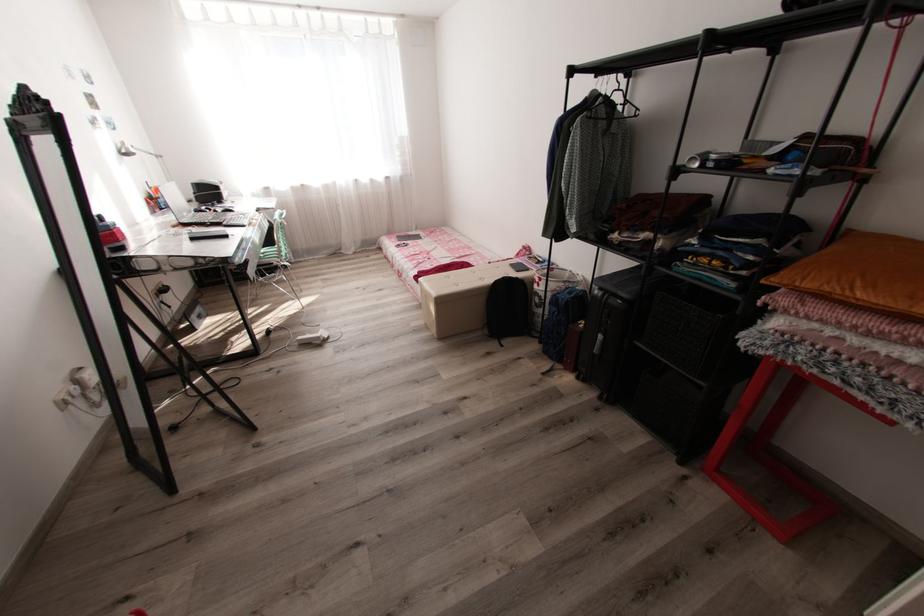
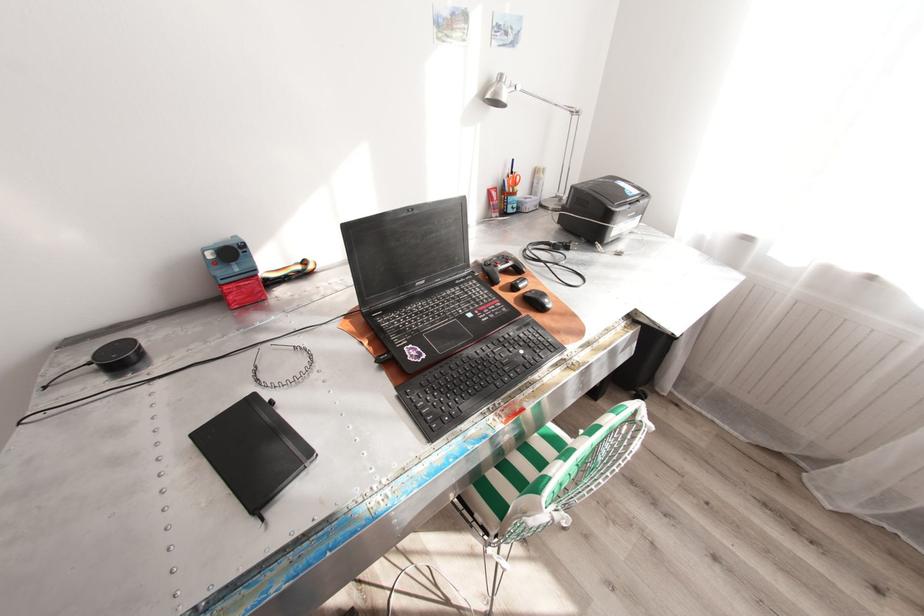
In the second image, find the point that corresponds to [155,188] in the first image.

(517, 172)